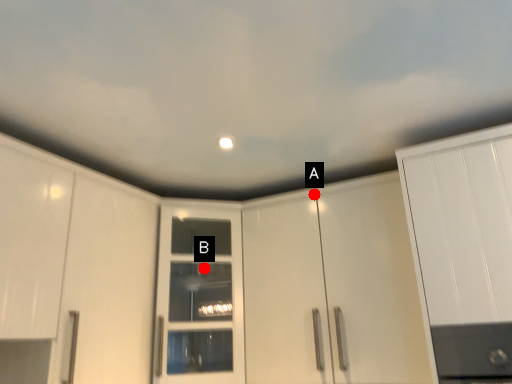
Question: Two points are circled on the image, labeled by A and B beside each circle. Which point is closer to the camera?

Choices:
 (A) A is closer
 (B) B is closer

Answer: (A)